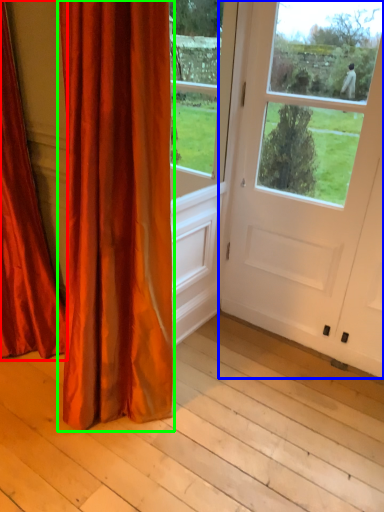
Question: Which object is positioned farthest from curtain (highlighted by a red box)? Select from door (highlighted by a blue box) and curtain (highlighted by a green box).

Choices:
 (A) door
 (B) curtain

Answer: (A)